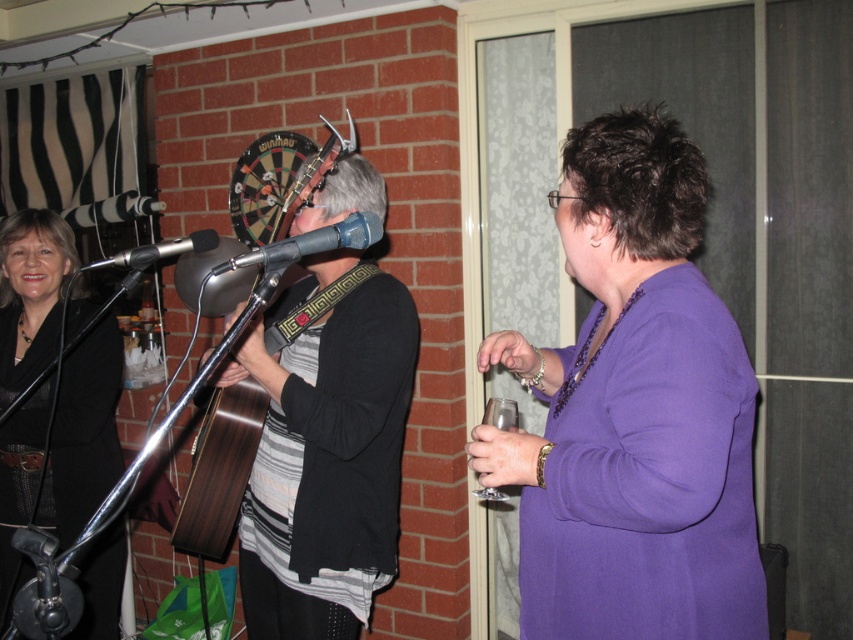
Question: Does matte black jacket at left have a greater width compared to matte plastic microphone at center?

Choices:
 (A) yes
 (B) no

Answer: (A)

Question: Considering the relative positions of purple matte dress at center and striped fabric guitar at center in the image provided, where is purple matte dress at center located with respect to striped fabric guitar at center?

Choices:
 (A) above
 (B) below

Answer: (A)

Question: Which point is farther to the camera?

Choices:
 (A) matte plastic microphone at center
 (B) metallic silver microphone at center
 (C) purple matte dress at center

Answer: (B)

Question: Is matte plastic microphone at center positioned at the back of metallic silver microphone at center?

Choices:
 (A) yes
 (B) no

Answer: (B)

Question: Considering the real-world distances, which object is farthest from the striped fabric guitar at center?

Choices:
 (A) metallic silver microphone at center
 (B) matte black jacket at left
 (C) matte plastic microphone at center
 (D) purple matte dress at center

Answer: (D)

Question: Which object is positioned closest to the striped fabric guitar at center?

Choices:
 (A) purple matte dress at center
 (B) matte plastic microphone at center
 (C) metallic silver microphone at center
 (D) matte black jacket at left

Answer: (B)